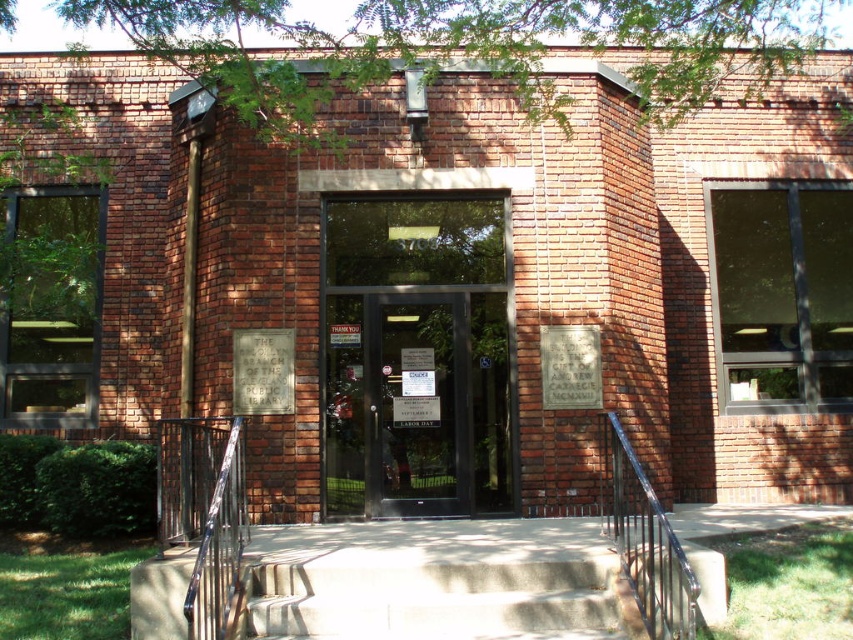
Between transparent glass door at center and concrete stairs at center, which one is positioned lower?

concrete stairs at center

Is point (503, 506) farther from camera compared to point (614, 561)?

Yes, it is.

Measure the distance between transparent glass door at center and camera.

The distance of transparent glass door at center from camera is 23.60 feet.

Where is `transparent glass door at center`? This screenshot has width=853, height=640. transparent glass door at center is located at coordinates 416,404.

Is point (260, 563) closer to viewer compared to point (178, 499)?

Yes.

How much distance is there between concrete stairs at center and black metal/rail at center?

3.46 feet

Describe the element at coordinates (433, 596) in the screenshot. I see `concrete stairs at center` at that location.

Where is `concrete stairs at center`? The height and width of the screenshot is (640, 853). concrete stairs at center is located at coordinates (433, 596).

Who is more distant from viewer, (369, 490) or (619, 488)?

The point (369, 490) is behind.

Looking at this image, is transparent glass door at center smaller than black metal/rail at center?

Incorrect, transparent glass door at center is not smaller in size than black metal/rail at center.

Between point (323, 358) and point (650, 512), which one is positioned behind?

The point (323, 358) is behind.

Identify the location of transparent glass door at center. (416, 404).